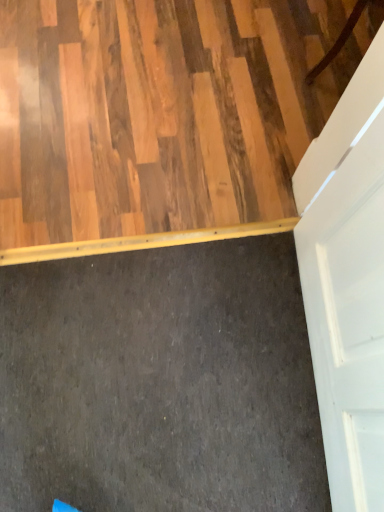
In order to face wooden floor at upper left, should I rotate leftwards or rightwards?

Turn right approximately 1.523 degrees to face it.

What are the coordinates of `wooden floor at upper left` in the screenshot? It's located at (162, 116).

Image resolution: width=384 pixels, height=512 pixels. What do you see at coordinates (162, 116) in the screenshot? I see `wooden floor at upper left` at bounding box center [162, 116].

The height and width of the screenshot is (512, 384). Identify the location of wooden floor at upper left. (162, 116).